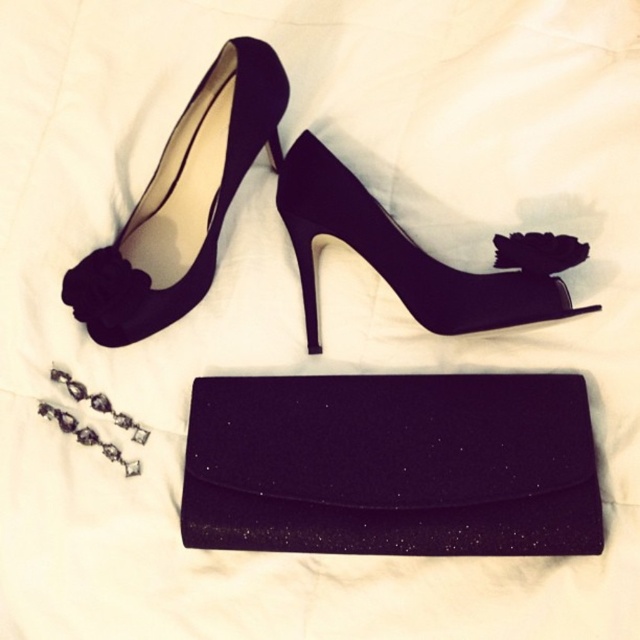
Question: Which object is positioned farthest from the satin black high-heeled shoe at upper left?

Choices:
 (A) satin black high-heeled shoe at center
 (B) sparkly purple clutch at center

Answer: (B)

Question: Is satin black high-heeled shoe at upper left behind satin black high-heeled shoe at center?

Choices:
 (A) no
 (B) yes

Answer: (B)

Question: Which point appears farthest from the camera in this image?

Choices:
 (A) [x=356, y=250]
 (B) [x=93, y=294]

Answer: (A)

Question: Based on their relative distances, which object is farther from the sparkly purple clutch at center?

Choices:
 (A) satin black high-heeled shoe at center
 (B) satin black high-heeled shoe at upper left

Answer: (B)

Question: Can you confirm if satin black high-heeled shoe at upper left is bigger than satin black high-heeled shoe at center?

Choices:
 (A) no
 (B) yes

Answer: (A)

Question: Can you confirm if sparkly purple clutch at center is bigger than satin black high-heeled shoe at upper left?

Choices:
 (A) yes
 (B) no

Answer: (A)